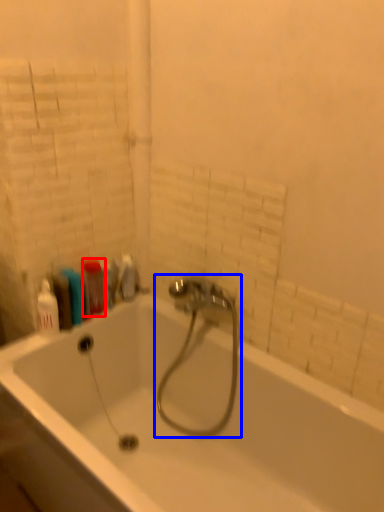
Question: Which of the following is the farthest to the observer, cleaning product (highlighted by a red box) or tap (highlighted by a blue box)?

Choices:
 (A) cleaning product
 (B) tap

Answer: (A)